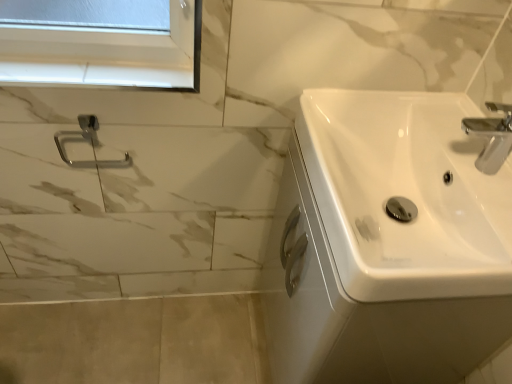
Question: Can you see white glossy sink at right touching white glossy window sill at upper left?

Choices:
 (A) yes
 (B) no

Answer: (B)

Question: Considering the relative positions of white glossy sink at right and white glossy window sill at upper left in the image provided, is white glossy sink at right in front of white glossy window sill at upper left?

Choices:
 (A) yes
 (B) no

Answer: (A)

Question: Considering the relative positions of white glossy sink at right and white glossy window sill at upper left in the image provided, is white glossy sink at right to the left of white glossy window sill at upper left from the viewer's perspective?

Choices:
 (A) yes
 (B) no

Answer: (B)

Question: Is white glossy sink at right turned away from white glossy window sill at upper left?

Choices:
 (A) yes
 (B) no

Answer: (B)

Question: Is white glossy sink at right not near white glossy window sill at upper left?

Choices:
 (A) yes
 (B) no

Answer: (B)

Question: In the image, is white glossy sink at right positioned in front of or behind satin nickel towel ring at upper left?

Choices:
 (A) front
 (B) behind

Answer: (A)

Question: From the image's perspective, relative to satin nickel towel ring at upper left, is white glossy sink at right above or below?

Choices:
 (A) above
 (B) below

Answer: (B)

Question: Is white glossy sink at right spatially inside satin nickel towel ring at upper left, or outside of it?

Choices:
 (A) inside
 (B) outside

Answer: (B)

Question: Considering the positions of white glossy sink at right and satin nickel towel ring at upper left in the image, is white glossy sink at right wider or thinner than satin nickel towel ring at upper left?

Choices:
 (A) thin
 (B) wide

Answer: (B)

Question: From the image's perspective, is satin nickel towel ring at upper left above or below white glossy window sill at upper left?

Choices:
 (A) above
 (B) below

Answer: (B)

Question: Considering the positions of satin nickel towel ring at upper left and white glossy window sill at upper left in the image, is satin nickel towel ring at upper left wider or thinner than white glossy window sill at upper left?

Choices:
 (A) wide
 (B) thin

Answer: (B)

Question: Which is correct: satin nickel towel ring at upper left is inside white glossy window sill at upper left, or outside of it?

Choices:
 (A) inside
 (B) outside

Answer: (B)

Question: Is point tap(110, 163) positioned closer to the camera than point tap(30, 82)?

Choices:
 (A) farther
 (B) closer

Answer: (A)

Question: In terms of height, does white glossy window sill at upper left look taller or shorter compared to satin nickel towel ring at upper left?

Choices:
 (A) tall
 (B) short

Answer: (B)

Question: In terms of size, does white glossy window sill at upper left appear bigger or smaller than satin nickel towel ring at upper left?

Choices:
 (A) small
 (B) big

Answer: (A)